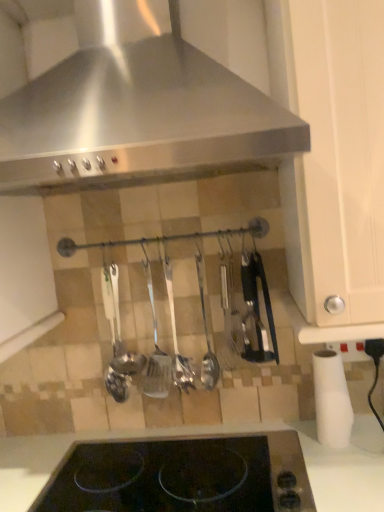
Question: Is point (201, 358) closer or farther from the camera than point (163, 254)?

Choices:
 (A) closer
 (B) farther

Answer: (B)

Question: From a real-world perspective, is polished metal ladle at center, arranged as the 1th silverware when viewed from the right, physically located above or below polished metal ladle at center, marked as the 2th silverware in a right-to-left arrangement?

Choices:
 (A) above
 (B) below

Answer: (B)

Question: Estimate the real-world distances between objects in this image. Which object is farther from the satin silver spoon at center?

Choices:
 (A) polished metal ladle at center, which is the second silverware in left-to-right order
 (B) white matte cabinet at right
 (C) polished metal ladle at center, which is counted as the first silverware, starting from the left
 (D) polished metal ladle at center, the third silverware when ordered from left to right
 (E) white matte paper towel at lower right

Answer: (B)

Question: Which object is the closest to the polished metal ladle at center, arranged as the 1th silverware when viewed from the right?

Choices:
 (A) polished metal ladle at center, which is counted as the first silverware, starting from the left
 (B) white matte cabinet at right
 (C) black glass at center
 (D) stainless steel range hood at upper center
 (E) polished metal ladle at center, marked as the 2th silverware in a right-to-left arrangement

Answer: (E)